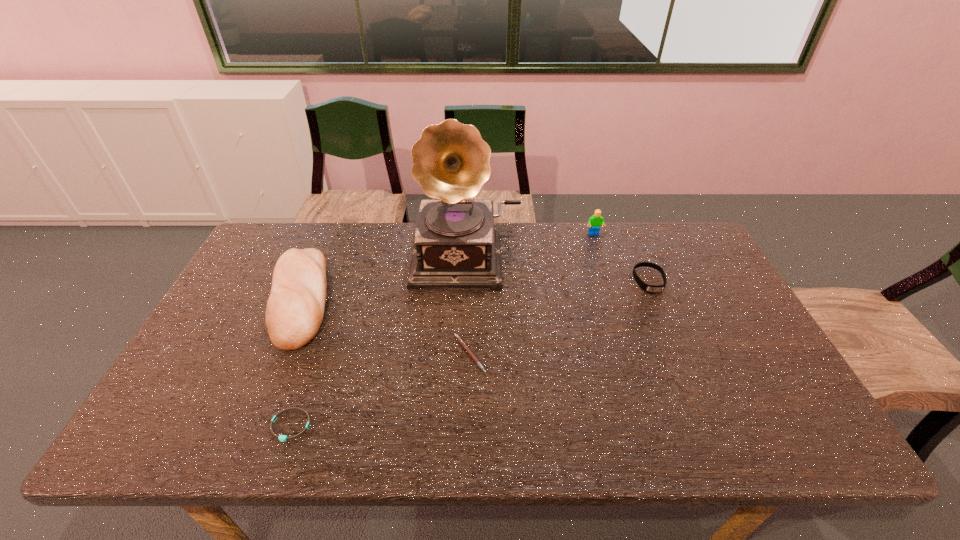
Identify the location of free space located 0.110m on the right of the bread. (371, 299).

Image resolution: width=960 pixels, height=540 pixels. Identify the location of free space located 0.170m on the display of the rightmost object. (673, 338).

I want to click on free spot located at the nib of the pen, so click(x=642, y=354).

Locate an element on the screen. The width and height of the screenshot is (960, 540). record player that is at the far edge is located at coordinates (455, 243).

The height and width of the screenshot is (540, 960). Identify the location of Lego that is at the far edge. coord(596,220).

Find the location of `bread at the far edge`. bread at the far edge is located at coordinates (295, 308).

Find the location of a particular element. Image resolution: width=960 pixels, height=540 pixels. object that is positioned at the near edge is located at coordinates (282, 438).

Locate an element on the screen. The image size is (960, 540). object that is at the left edge is located at coordinates (295, 308).

Where is `object situated at the far left corner`? This screenshot has width=960, height=540. object situated at the far left corner is located at coordinates (295, 308).

Image resolution: width=960 pixels, height=540 pixels. In the image, there is a desktop. What are the coordinates of `vacant region at the far edge` in the screenshot? It's located at (649, 246).